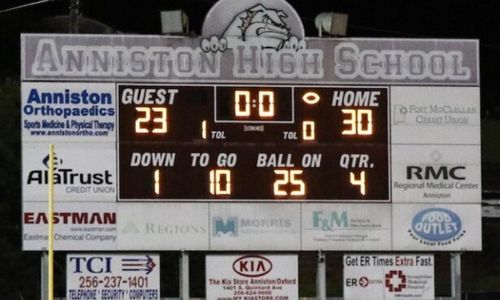
The width and height of the screenshot is (500, 300). What are the coordinates of `pa system speakers` in the screenshot? It's located at (174, 23), (337, 25).